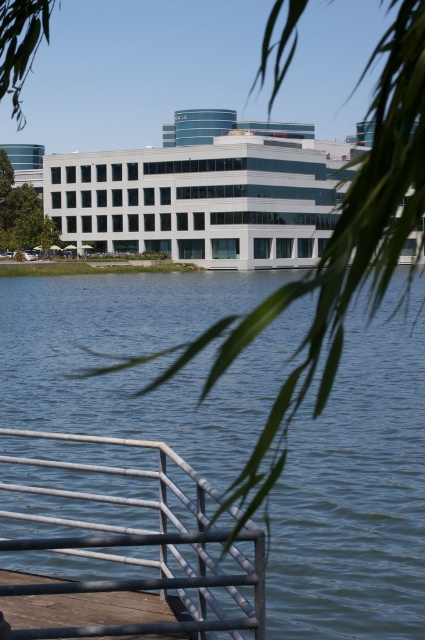
Question: Which object is positioned farthest from the blue water at lower center?

Choices:
 (A) silver metallic rail at lower left
 (B) brown wooden dock at lower left

Answer: (B)

Question: Estimate the real-world distances between objects in this image. Which object is farther from the brown wooden dock at lower left?

Choices:
 (A) silver metallic rail at lower left
 (B) blue water at lower center

Answer: (B)

Question: Does blue water at lower center appear on the right side of brown wooden dock at lower left?

Choices:
 (A) no
 (B) yes

Answer: (A)

Question: Based on their relative distances, which object is nearer to the blue water at lower center?

Choices:
 (A) brown wooden dock at lower left
 (B) silver metallic rail at lower left

Answer: (B)

Question: Is the position of blue water at lower center more distant than that of silver metallic rail at lower left?

Choices:
 (A) yes
 (B) no

Answer: (B)

Question: Can you confirm if blue water at lower center is positioned above silver metallic rail at lower left?

Choices:
 (A) no
 (B) yes

Answer: (B)